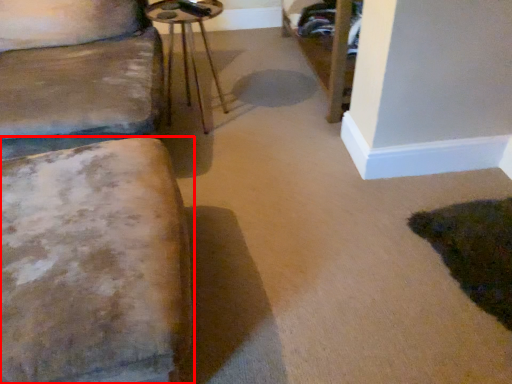
Question: From the image's perspective, what is the correct spatial relationship of furniture (annotated by the red box) in relation to side table?

Choices:
 (A) above
 (B) below

Answer: (B)